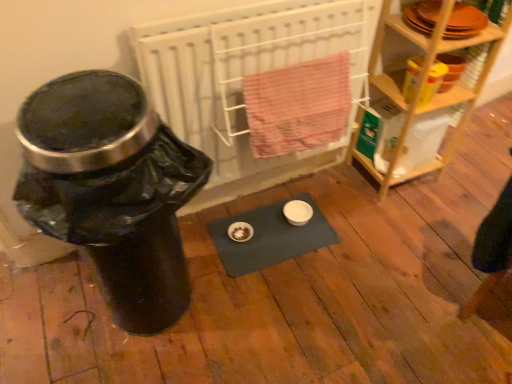
Question: From the image's perspective, relative to blue fabric yoga mat at center, is white radiator at center above or below?

Choices:
 (A) above
 (B) below

Answer: (A)

Question: In the image, is white radiator at center on the left side or the right side of blue fabric yoga mat at center?

Choices:
 (A) right
 (B) left

Answer: (B)

Question: Considering the real-world distances, which object is farthest from the black plastic water cooler at left?

Choices:
 (A) white radiator at center
 (B) blue fabric yoga mat at center
 (C) wooden shelf at right

Answer: (C)

Question: Which of these objects is positioned farthest from the white radiator at center?

Choices:
 (A) wooden shelf at right
 (B) black plastic water cooler at left
 (C) blue fabric yoga mat at center

Answer: (B)